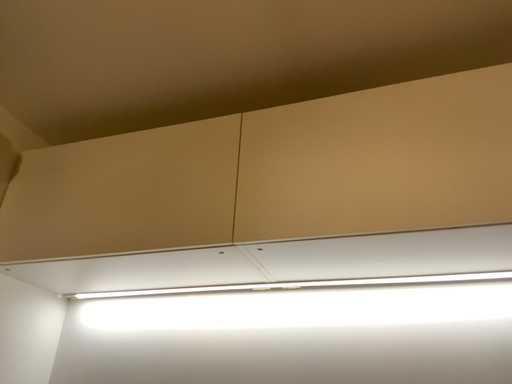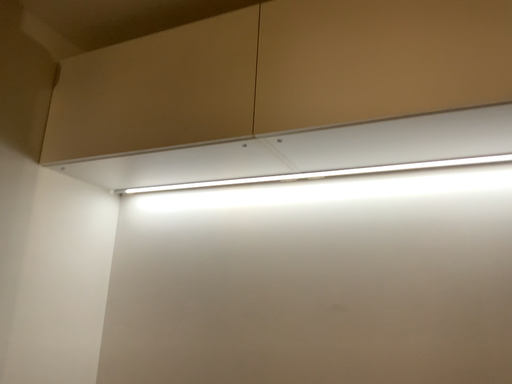
Question: How did the camera likely rotate when shooting the video?

Choices:
 (A) rotated upward
 (B) rotated downward

Answer: (B)